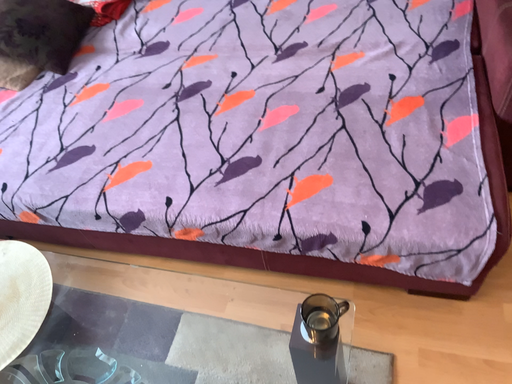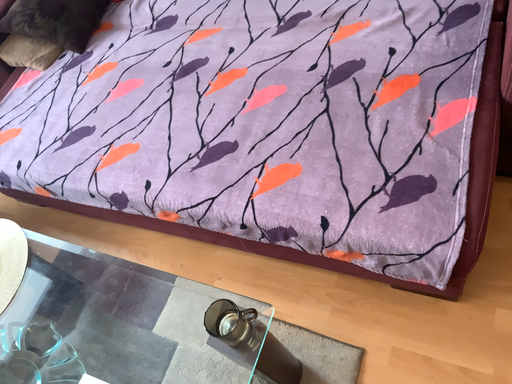
Question: Which way did the camera rotate in the video?

Choices:
 (A) rotated right
 (B) rotated left

Answer: (B)